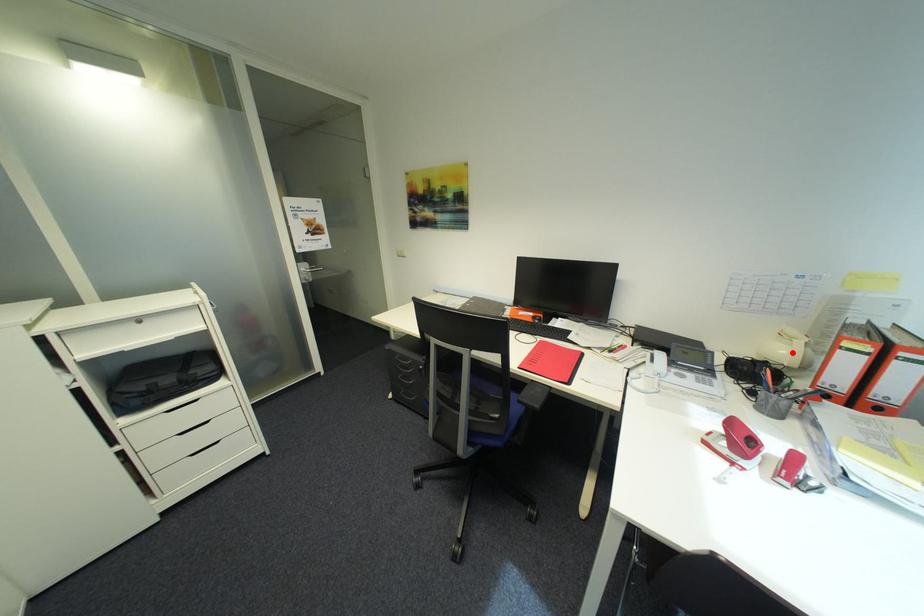
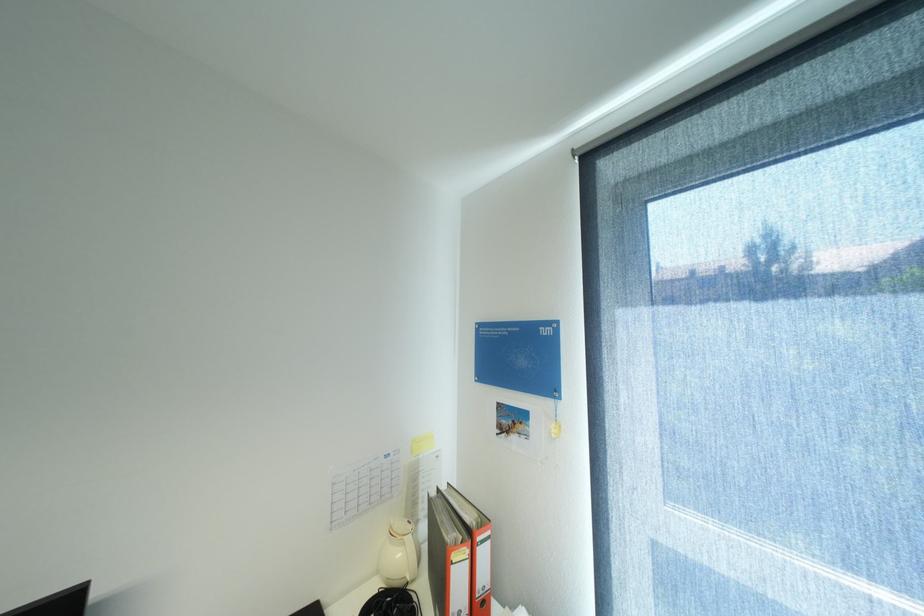
Where in the second image is the point corresponding to the highlighted location from the first image?

(407, 554)